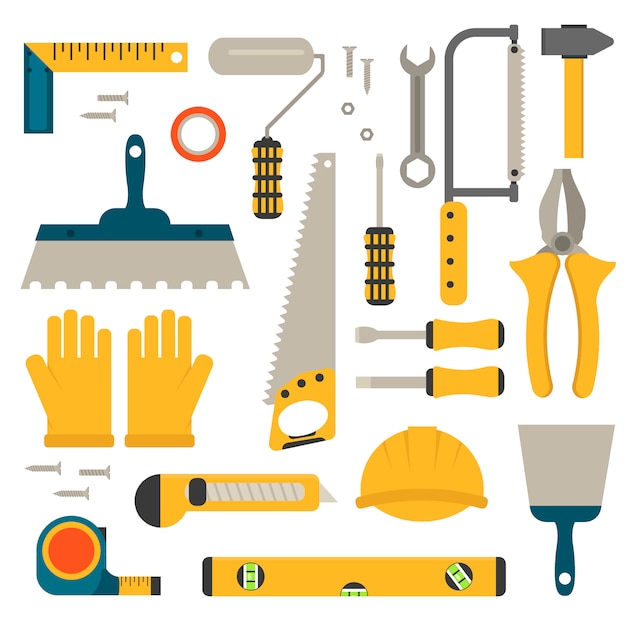
This screenshot has height=626, width=626. Find the location of `black lines on bubble on a level`. black lines on bubble on a level is located at coordinates (249, 580), (250, 572), (347, 592), (357, 592), (462, 580), (456, 570).